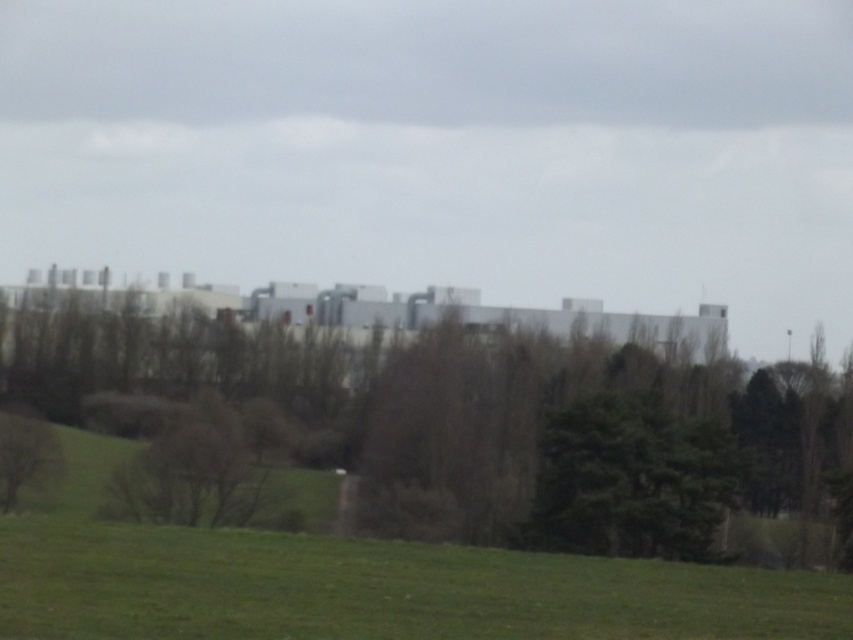
Question: Which of the following is the farthest from the observer?

Choices:
 (A) green leafy tree at center
 (B) green leafy tree at lower left

Answer: (A)

Question: Is green leafy tree at center bigger than green leafy tree at lower left?

Choices:
 (A) no
 (B) yes

Answer: (B)

Question: Does green leafy tree at center appear under green leafy tree at lower left?

Choices:
 (A) yes
 (B) no

Answer: (B)

Question: Does green leafy tree at center appear on the left side of green leafy tree at lower left?

Choices:
 (A) yes
 (B) no

Answer: (B)

Question: Among these points, which one is farthest from the camera?

Choices:
 (A) (459, 417)
 (B) (53, 483)

Answer: (A)